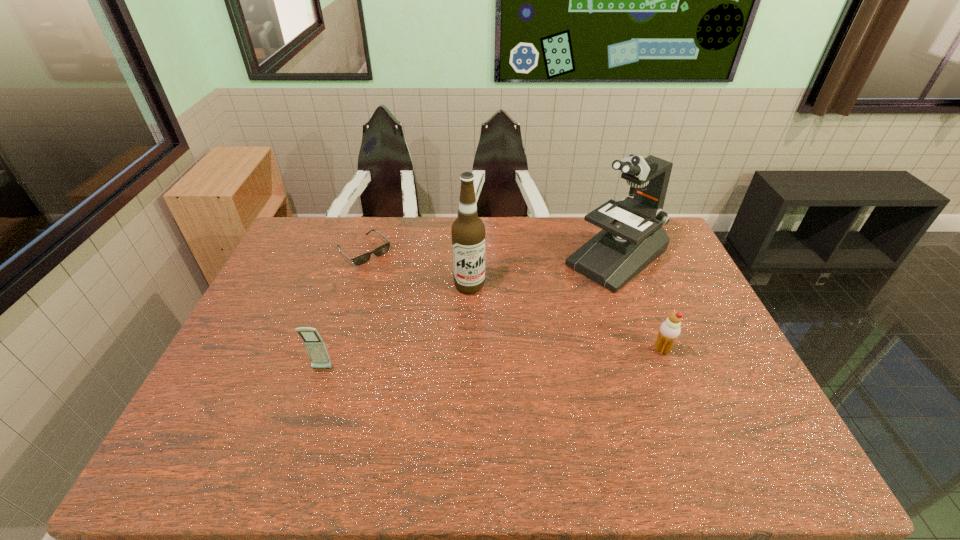
Where is `vacant space on the desktop that is between the nearest object and the icecream and is positioned through the eyepieces of the microscope`? vacant space on the desktop that is between the nearest object and the icecream and is positioned through the eyepieces of the microscope is located at coordinates (483, 360).

Image resolution: width=960 pixels, height=540 pixels. Identify the location of vacant space on the desktop that is between the cellular telephone and the second nearest object and is positioned on the front-facing side of the shortest object. (487, 360).

This screenshot has height=540, width=960. I want to click on free space on the desktop that is between the nearest object and the fourth farthest object and is positioned on the label of the third object from left to right, so click(x=497, y=359).